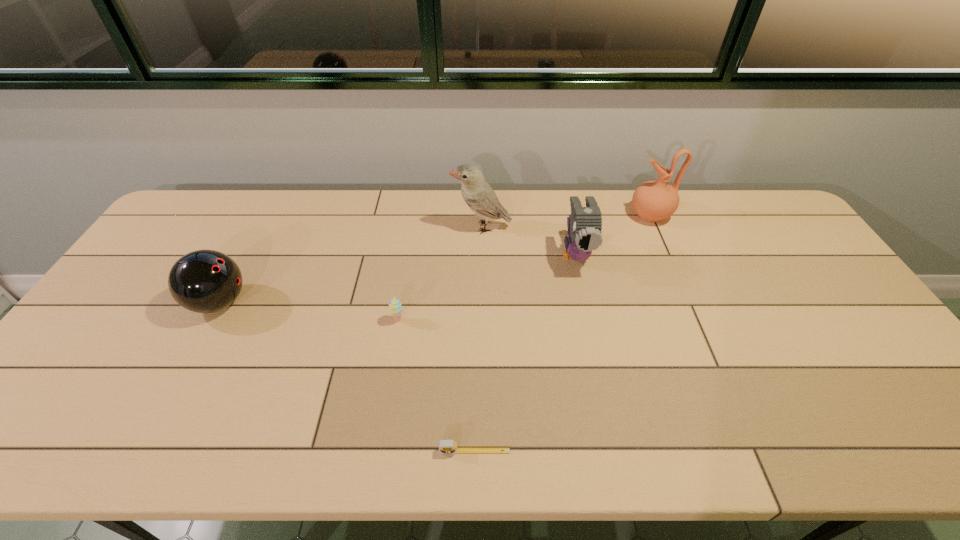
Where is `free space at the far edge of the desktop`? Image resolution: width=960 pixels, height=540 pixels. free space at the far edge of the desktop is located at coordinates (723, 232).

Image resolution: width=960 pixels, height=540 pixels. In the image, there is a desktop. Identify the location of vacant space at the near edge. (620, 435).

The image size is (960, 540). What are the coordinates of `vacant area at the far right corner of the desktop` in the screenshot? It's located at (780, 217).

Identify the location of vacant region between the second shortest object and the tape measure. coord(436,385).

The image size is (960, 540). I want to click on free spot between the pottery and the left bird, so click(566, 221).

You are a GUI agent. You are given a task and a screenshot of the screen. Output one action in this format:
    pyautogui.click(x=<x>, y=<y>)
    Task: Click on the blank region between the leftmost object and the sherbert
    This screenshot has height=540, width=960.
    Given the screenshot: What is the action you would take?
    pyautogui.click(x=309, y=311)

Identify the location of free space between the pottery and the left bird. (566, 221).

Where is `vacant region between the rightmost object and the leftmost object`? The width and height of the screenshot is (960, 540). vacant region between the rightmost object and the leftmost object is located at coordinates (435, 259).

You are a GUI agent. You are given a task and a screenshot of the screen. Output one action in this format:
    pyautogui.click(x=<x>, y=<y>)
    Task: Click on the free space between the shortest object and the bowling ball
    This screenshot has height=540, width=960.
    Given the screenshot: What is the action you would take?
    pyautogui.click(x=348, y=377)

The width and height of the screenshot is (960, 540). Find the location of `free point between the shorter bird and the left bird`. free point between the shorter bird and the left bird is located at coordinates (529, 241).